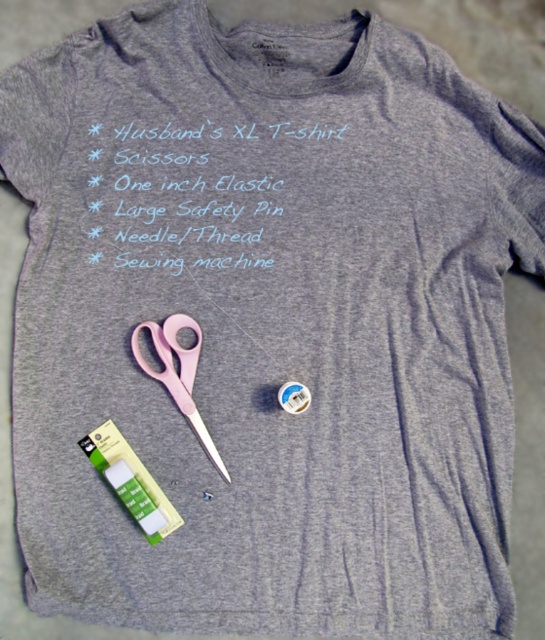
Is gray fabric husband's xl t-shirt at upper center to the right of pink plastic scissors at lower left from the viewer's perspective?

Indeed, gray fabric husband's xl t-shirt at upper center is positioned on the right side of pink plastic scissors at lower left.

Is gray fabric husband's xl t-shirt at upper center smaller than pink plastic scissors at lower left?

Actually, gray fabric husband's xl t-shirt at upper center might be larger than pink plastic scissors at lower left.

Between point (229, 273) and point (159, 326), which one is positioned in front?

Positioned in front is point (159, 326).

Where is `gray fabric husband's xl t-shirt at upper center`? gray fabric husband's xl t-shirt at upper center is located at coordinates (216, 195).